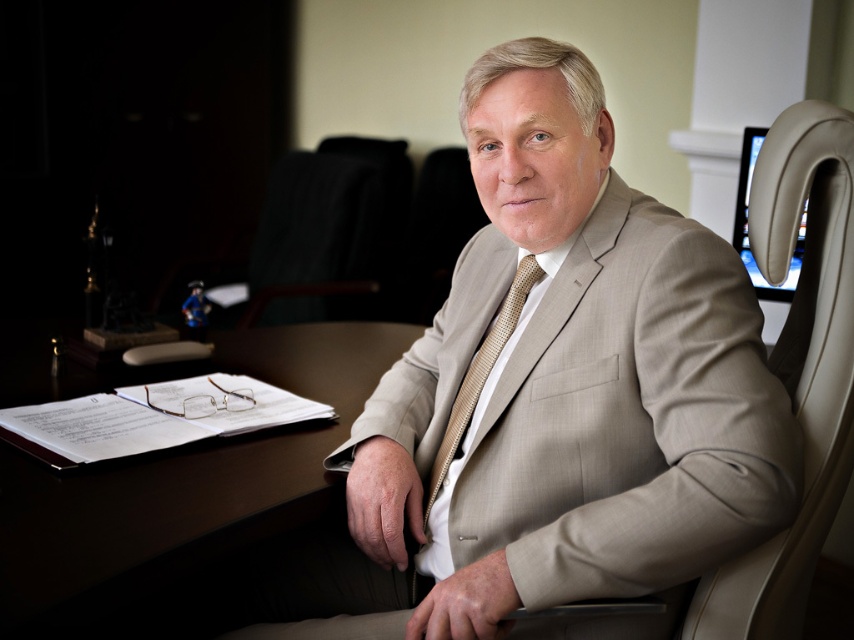
You are an office worker who needs to place a new keyboard that is 15 inches wide. The dark wood table at center and beige leather monitor at upper right are in your workspace. Which surface can accommodate the keyboard without exceeding its width?

The dark wood table at center has a larger size compared to beige leather monitor at upper right, so it can accommodate the 15 inch keyboard.

You are an office worker who needs to place a new document on the dark wood table at center and the beige leather monitor at upper right. Which object should you approach first if you are standing to the left of both objects?

You should approach the dark wood table at center first because it is closer to your current position on the left side compared to the beige leather monitor at upper right, which is positioned further to the right.

You are a visitor in the office and need to adjust the height of the beige leather monitor at upper right to match the height of the beige leather swivel chair at right. Based on their current heights, which object should you lower or raise?

The beige leather swivel chair at right is taller than the beige leather monitor at upper right. To match their heights, you should lower the beige leather swivel chair at right or raise the beige leather monitor at upper right.